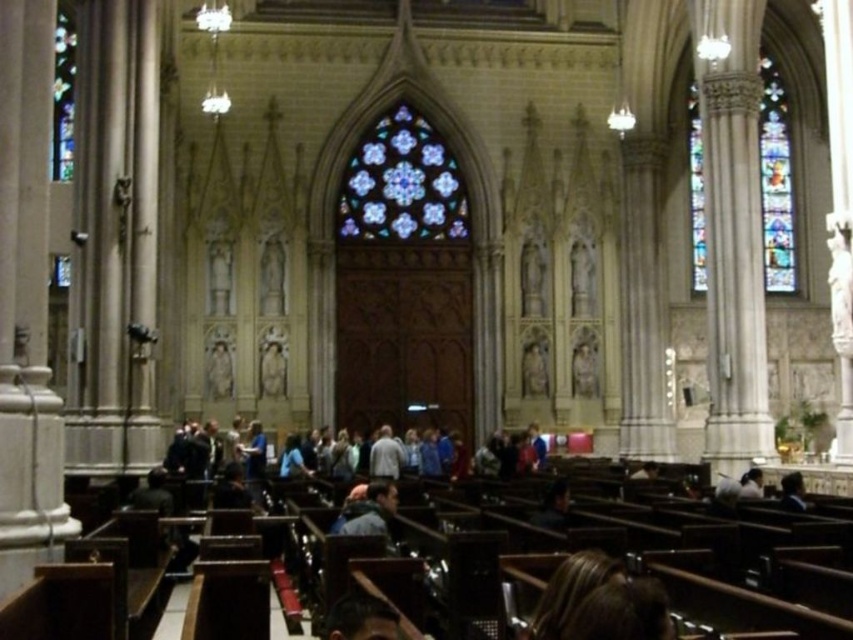
You are standing in the cathedral and want to take a photo of both the stained glass at center and the stained glass window at right. Which one should you aim your camera towards first to capture them in the correct left to right order?

You should aim your camera towards the stained glass at center first, as it is positioned to the left of the stained glass window at right, ensuring the correct left to right order in the photo.